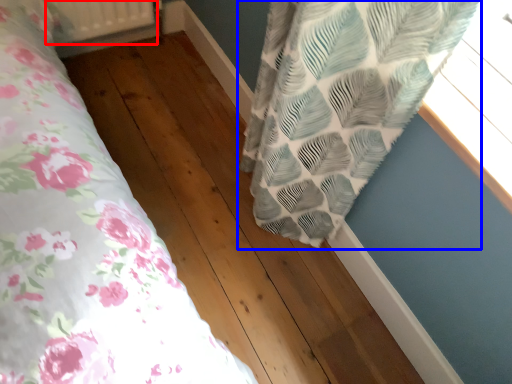
Question: Which point is further to the camera, radiator (highlighted by a red box) or curtain (highlighted by a blue box)?

Choices:
 (A) radiator
 (B) curtain

Answer: (A)